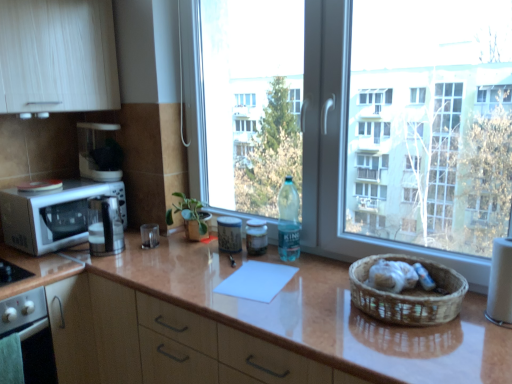
At what (x,y) coordinates should I click in order to perform the action: click on free space above glossy brown countertop at center (from a real-world perspective). Please return your answer as a coordinate pair (x, y). The height and width of the screenshot is (384, 512). Looking at the image, I should click on (275, 291).